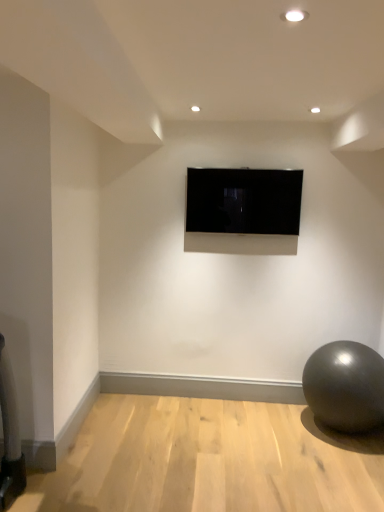
Question: Relative to shiny metallic ball at lower right, is black glossy tv at center in front or behind?

Choices:
 (A) behind
 (B) front

Answer: (A)

Question: Which is correct: black glossy tv at center is inside shiny metallic ball at lower right, or outside of it?

Choices:
 (A) inside
 (B) outside

Answer: (B)

Question: Is black glossy tv at center taller or shorter than shiny metallic ball at lower right?

Choices:
 (A) short
 (B) tall

Answer: (A)

Question: From the image's perspective, is shiny metallic ball at lower right above or below black glossy tv at center?

Choices:
 (A) above
 (B) below

Answer: (B)

Question: Is shiny metallic ball at lower right spatially inside black glossy tv at center, or outside of it?

Choices:
 (A) outside
 (B) inside

Answer: (A)

Question: Is shiny metallic ball at lower right to the left or to the right of black glossy tv at center in the image?

Choices:
 (A) right
 (B) left

Answer: (A)

Question: Is shiny metallic ball at lower right in front of or behind black glossy tv at center in the image?

Choices:
 (A) behind
 (B) front

Answer: (B)